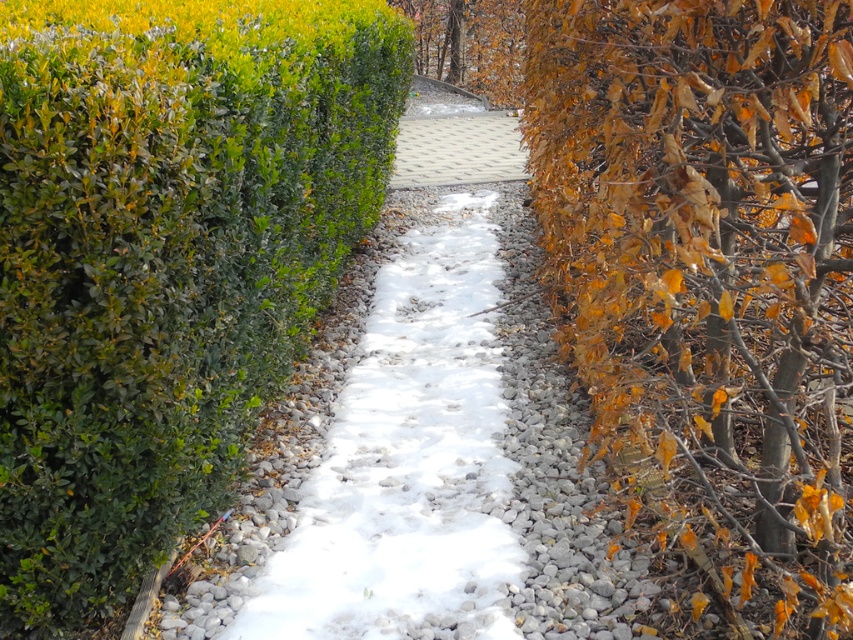
Who is higher up, green leafy bush at upper left or yellow-orange leafy tree at right?

green leafy bush at upper left is above.

Who is positioned more to the right, green leafy bush at upper left or yellow-orange leafy tree at right?

From the viewer's perspective, yellow-orange leafy tree at right appears more on the right side.

Is point (212, 492) more distant than point (833, 164)?

Yes, point (212, 492) is farther from viewer.

Locate an element on the screen. green leafy bush at upper left is located at coordinates (164, 260).

Who is higher up, yellow-orange leafy tree at right or pebble gray paving at center?

pebble gray paving at center

Is yellow-orange leafy tree at right smaller than pebble gray paving at center?

Actually, yellow-orange leafy tree at right might be larger than pebble gray paving at center.

Describe the element at coordinates (706, 285) in the screenshot. This screenshot has width=853, height=640. I see `yellow-orange leafy tree at right` at that location.

I want to click on yellow-orange leafy tree at right, so 706,285.

Does yellow-orange leafy tree at right have a larger size compared to brown leafy tree at upper center?

Yes.

Locate an element on the screen. This screenshot has width=853, height=640. yellow-orange leafy tree at right is located at coordinates (706, 285).

Describe the element at coordinates (706, 285) in the screenshot. I see `yellow-orange leafy tree at right` at that location.

Locate an element on the screen. Image resolution: width=853 pixels, height=640 pixels. yellow-orange leafy tree at right is located at coordinates (706, 285).